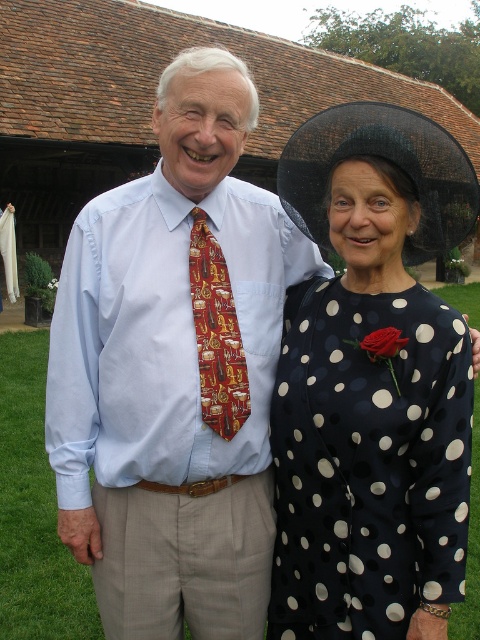
Question: Which of the following is the closest to the observer?

Choices:
 (A) (233, 413)
 (B) (216, 314)

Answer: (A)

Question: Which object is closer to the camera taking this photo?

Choices:
 (A) black dotted dress at center
 (B) red silk tie at center
 (C) matte silk tie at center

Answer: (A)

Question: Is matte silk tie at center closer to camera compared to red silk tie at center?

Choices:
 (A) yes
 (B) no

Answer: (B)

Question: Which point appears farthest from the camera in this image?

Choices:
 (A) (82, 333)
 (B) (213, 387)

Answer: (A)

Question: Does matte silk tie at center appear under matte red rose at upper right?

Choices:
 (A) yes
 (B) no

Answer: (A)

Question: Can you confirm if matte silk tie at center is thinner than red silk tie at center?

Choices:
 (A) no
 (B) yes

Answer: (A)